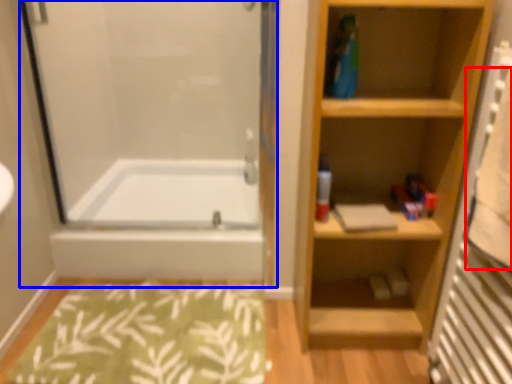
Question: Which point is closer to the camera, bath towel (highlighted by a red box) or screen door (highlighted by a blue box)?

Choices:
 (A) bath towel
 (B) screen door

Answer: (A)